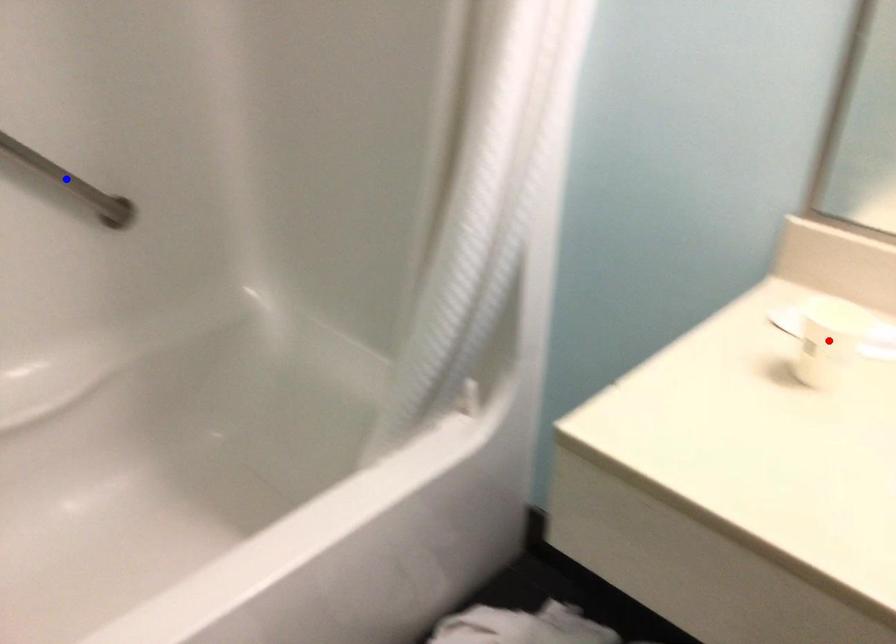
Question: Which of the two points in the image is closer to the camera?

Choices:
 (A) Blue point is closer.
 (B) Red point is closer.

Answer: (B)